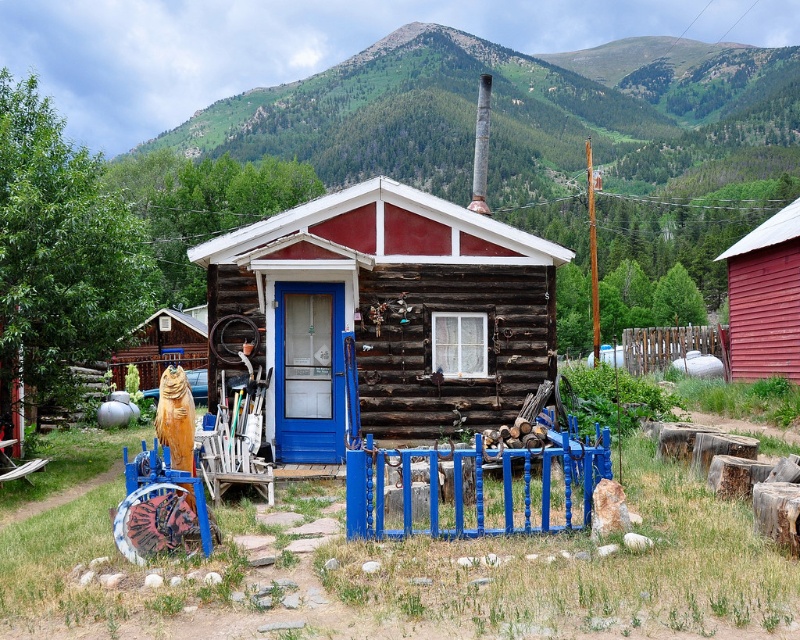
Question: Does green forested mountain at upper center have a lesser width compared to red wood cabin at right?

Choices:
 (A) yes
 (B) no

Answer: (B)

Question: Considering the real-world distances, which object is closest to the red wood cabin at right?

Choices:
 (A) green forested mountain at upper center
 (B) wooden cabin at center
 (C) blue painted wood fence at center

Answer: (B)

Question: Which is nearer to the red wood cabin at right?

Choices:
 (A) blue painted wood fence at center
 (B) green forested mountain at upper center
 (C) wooden fence at right

Answer: (C)

Question: Based on their relative distances, which object is farther from the wooden fence at right?

Choices:
 (A) green forested mountain at upper center
 (B) wooden cabin at center
 (C) blue painted wood fence at center
 (D) red wood cabin at right

Answer: (A)

Question: Is red wood cabin at right thinner than wooden fence at right?

Choices:
 (A) yes
 (B) no

Answer: (A)

Question: From the image, what is the correct spatial relationship of blue painted wood fence at center in relation to red wood cabin at right?

Choices:
 (A) right
 (B) left

Answer: (B)